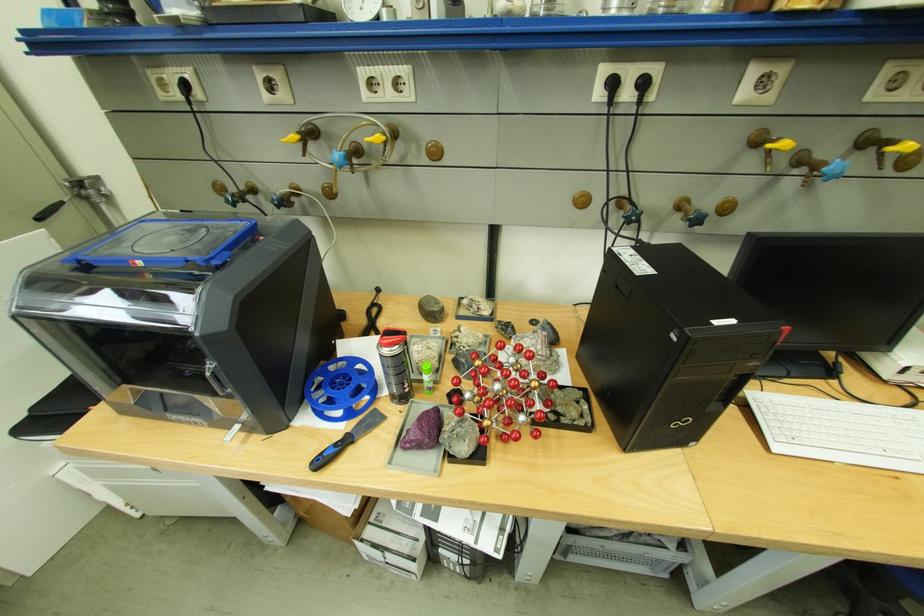
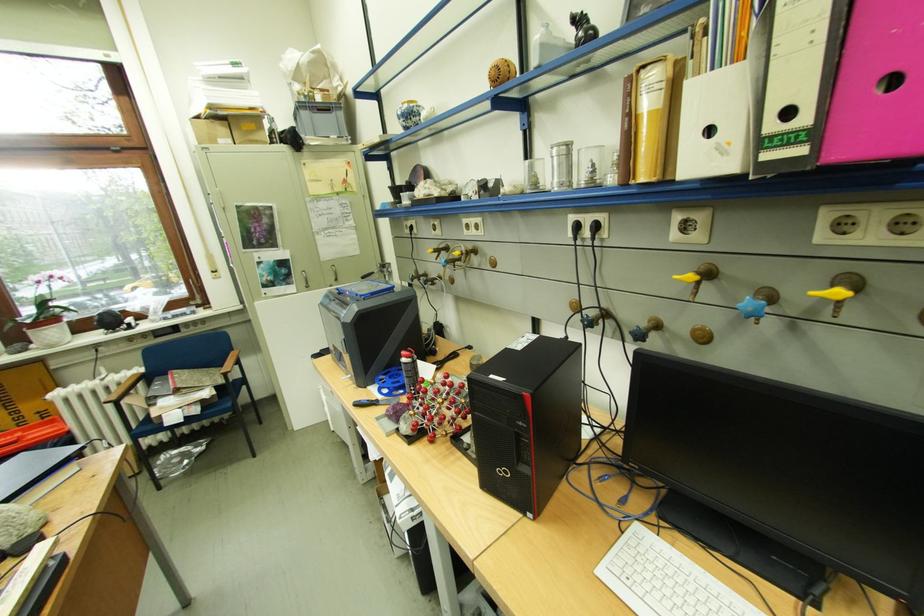
Where in the second image is the point corresponding to point (877, 132) from the first image?

(852, 275)